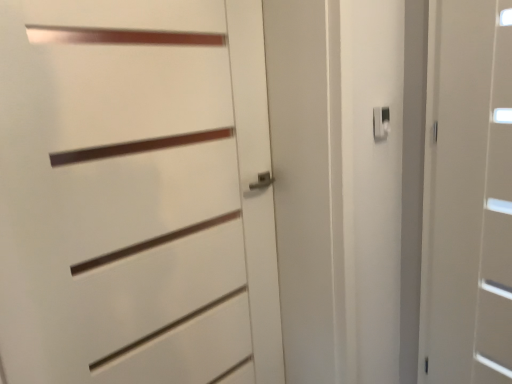
Question: Is white matte door at center, which is counted as the 1th door, starting from the left, not inside white plastic latch at upper right?

Choices:
 (A) no
 (B) yes

Answer: (B)

Question: Considering the relative sizes of white matte door at center, which is counted as the 2th door, starting from the right, and white plastic latch at upper right in the image provided, is white matte door at center, which is counted as the 2th door, starting from the right, taller than white plastic latch at upper right?

Choices:
 (A) no
 (B) yes

Answer: (B)

Question: Would you consider white matte door at center, which is counted as the 2th door, starting from the right, to be distant from white plastic latch at upper right?

Choices:
 (A) no
 (B) yes

Answer: (A)

Question: Is white matte door at center, which is counted as the 1th door, starting from the left, shorter than white plastic latch at upper right?

Choices:
 (A) yes
 (B) no

Answer: (B)

Question: From a real-world perspective, is white matte door at center, which is counted as the 2th door, starting from the right, positioned over white plastic latch at upper right based on gravity?

Choices:
 (A) yes
 (B) no

Answer: (B)

Question: Is white matte door at center, which is counted as the 2th door, starting from the right, wider or thinner than white matte door at right, which ranks as the 2th door in left-to-right order?

Choices:
 (A) thin
 (B) wide

Answer: (A)

Question: Considering the positions of point (154, 94) and point (459, 56), is point (154, 94) closer or farther from the camera than point (459, 56)?

Choices:
 (A) farther
 (B) closer

Answer: (B)

Question: In terms of size, does white matte door at center, which is counted as the 2th door, starting from the right, appear bigger or smaller than white matte door at right, placed as the first door when sorted from right to left?

Choices:
 (A) small
 (B) big

Answer: (B)

Question: Based on their positions, is white matte door at center, which is counted as the 1th door, starting from the left, located to the left or right of white matte door at right, placed as the first door when sorted from right to left?

Choices:
 (A) left
 (B) right

Answer: (A)

Question: In the image, is white matte door at center, which is counted as the 2th door, starting from the right, on the left side or the right side of white plastic latch at upper right?

Choices:
 (A) right
 (B) left

Answer: (B)

Question: Considering the positions of white matte door at center, which is counted as the 1th door, starting from the left, and white plastic latch at upper right in the image, is white matte door at center, which is counted as the 1th door, starting from the left, wider or thinner than white plastic latch at upper right?

Choices:
 (A) thin
 (B) wide

Answer: (B)

Question: Is white matte door at center, which is counted as the 2th door, starting from the right, taller or shorter than white plastic latch at upper right?

Choices:
 (A) short
 (B) tall

Answer: (B)

Question: Is white matte door at center, which is counted as the 2th door, starting from the right, in front of or behind white plastic latch at upper right in the image?

Choices:
 (A) behind
 (B) front

Answer: (B)

Question: In the image, is white matte door at right, which ranks as the 2th door in left-to-right order, positioned in front of or behind white matte door at center, which is counted as the 1th door, starting from the left?

Choices:
 (A) front
 (B) behind

Answer: (B)

Question: From the image's perspective, is white matte door at right, placed as the first door when sorted from right to left, above or below white matte door at center, which is counted as the 2th door, starting from the right?

Choices:
 (A) below
 (B) above

Answer: (B)